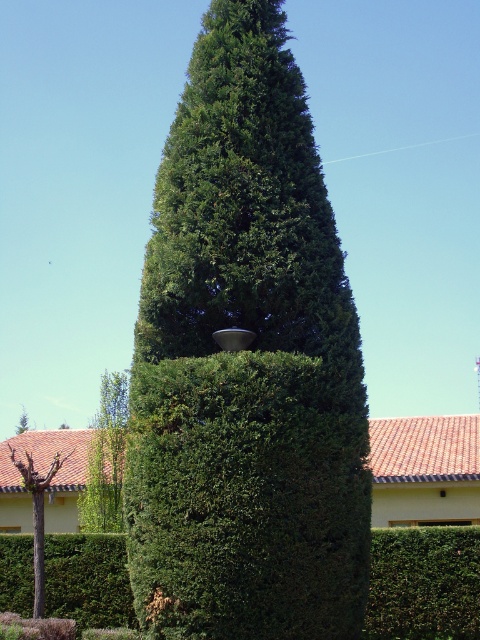
You are standing in the garden and want to take a photo of the green leafy tree at center and the brown bark tree at lower left. Which tree will appear closer to the camera in the photo?

The green leafy tree at center will appear closer to the camera in the photo because it is positioned in front of the brown bark tree at lower left.

You are standing in the garden and want to place a small statue between the green leafy tree at center and the green leafy shrub at center. Which side of the shrub should you place it on to be between them?

You should place the statue to the right side of the green leafy shrub at center because the green leafy tree at center is to the left of the green leafy shrub at center, so placing it to the right of the shrub would position it between them.

You are planning to place a new garden bench in the garden scene. The bench requires a space wider than the green leafy tree at center but narrower than the green leafy shrub at lower right. Is there a suitable spot between them for the bench?

The green leafy tree at center has a lesser width compared to the green leafy shrub at lower right. Therefore, there is a suitable spot between their widths for the bench since the bench requires a space wider than the tree but narrower than the shrub.